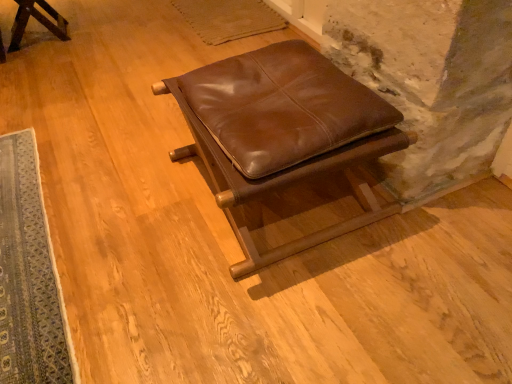
At what (x,y) coordinates should I click in order to perform the action: click on vacant space in between matte brown leather stool at upper left, the 1th furniture in the back-to-front sequence, and blue woven rug at lower left. Please return your answer as a coordinate pair (x, y). This screenshot has height=384, width=512. Looking at the image, I should click on (44, 116).